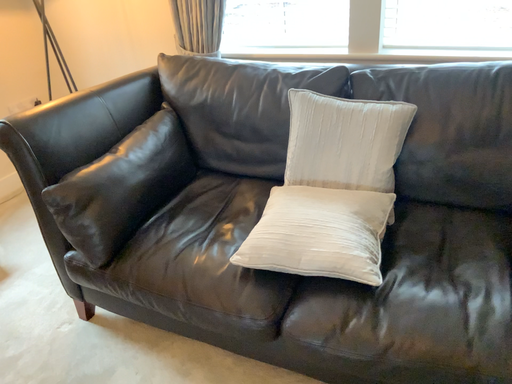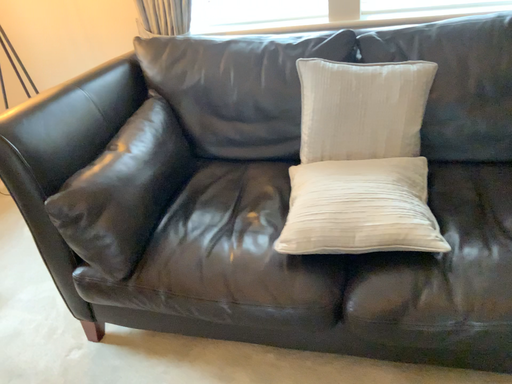
Question: How did the camera likely rotate when shooting the video?

Choices:
 (A) rotated left
 (B) rotated right

Answer: (B)